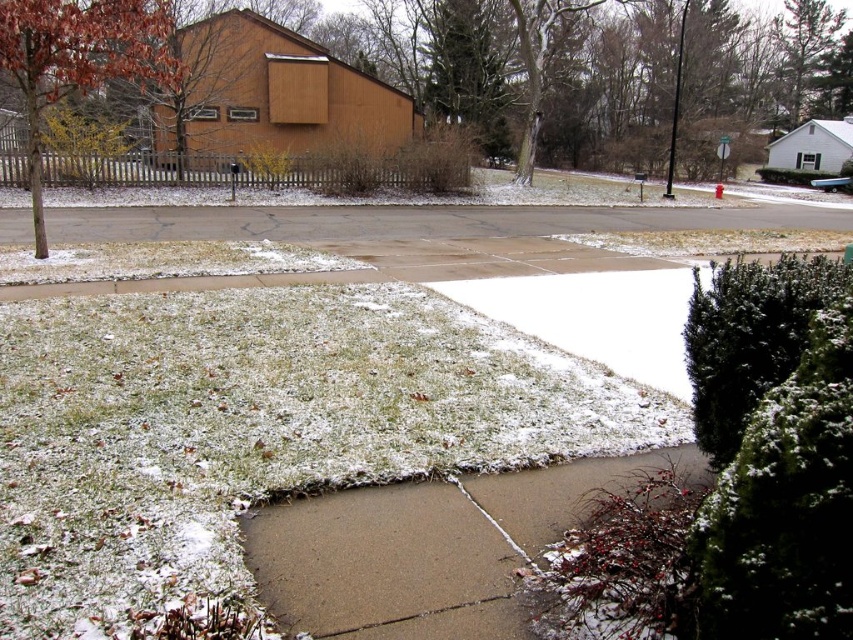
You are standing at the point marked by the coordinate point at (x=427, y=548). What is the nearest object to you in the scene?

The nearest object to you at point (x=427, y=548) is the brown concrete sidewalk at lower center, as the coordinate marks its location.